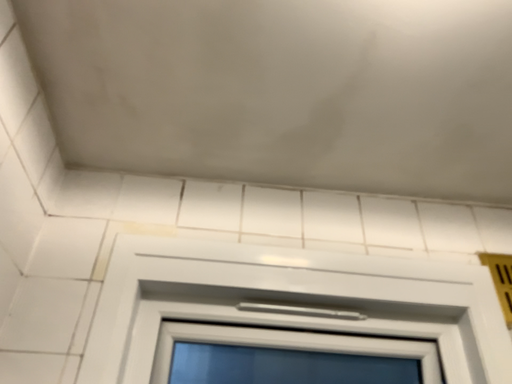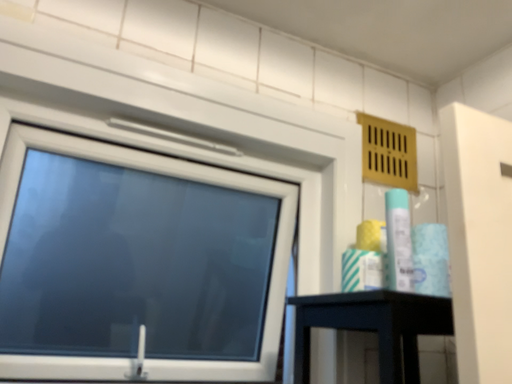
Question: How did the camera likely rotate when shooting the video?

Choices:
 (A) rotated left
 (B) rotated right

Answer: (B)